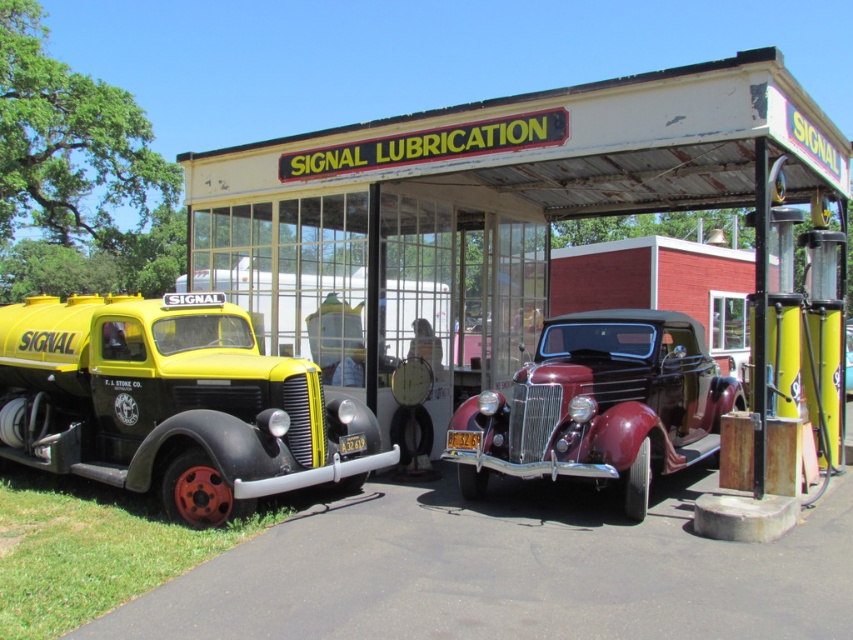
You are a photographer trying to capture both the rusty metal gas station at center and the shiny maroon convertible at center in a single frame. Based on their heights, which object should you position closer to the camera to ensure both are fully visible?

The rusty metal gas station at center is taller than the shiny maroon convertible at center. To ensure both are fully visible in the frame, position the rusty metal gas station at center closer to the camera so its height doesn

You are a customer at the vintage gas station and need to access the shiny maroon convertible at center parked in front of the canopy. Is the yellow matte truck at left blocking your path to the convertible?

The yellow matte truck at left is positioned under the shiny maroon convertible at center, so the truck is blocking the path to the convertible. You will need to move the truck first to access the convertible.

You are driving a car that is 4 meters long. You want to park your car between the rusty metal gas station at center and the yellow matte truck at left. Is there enough space between them to park your car?

The rusty metal gas station at center is 5.88 meters from the yellow matte truck at left. Since your car is 4 meters long, there is enough space between them to park your car.